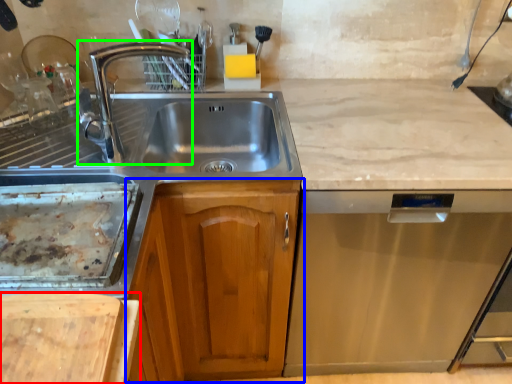
Question: Which object is positioned farthest from cutting board (highlighted by a red box)? Select from cabinetry (highlighted by a blue box) and tap (highlighted by a green box).

Choices:
 (A) cabinetry
 (B) tap

Answer: (B)